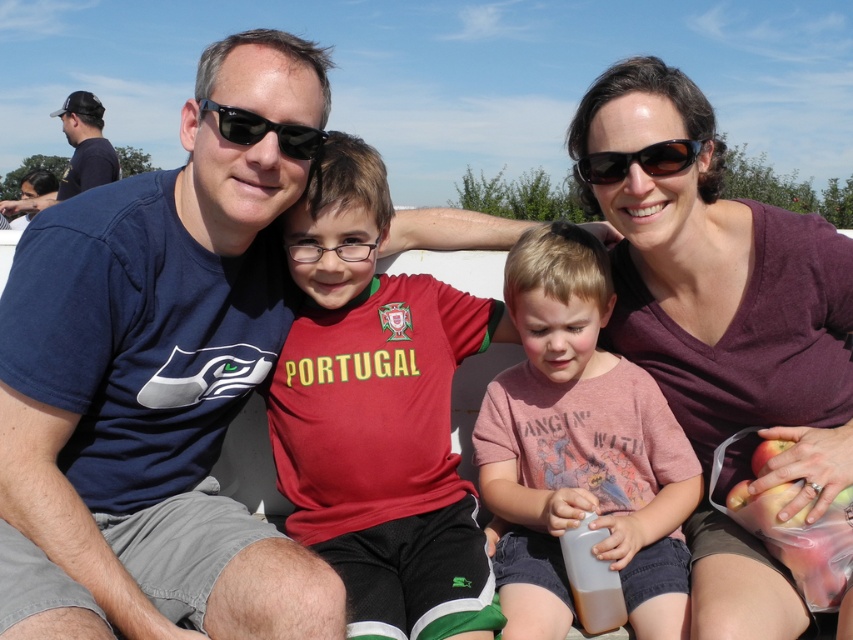
Question: Which of the following is the farthest from the observer?

Choices:
 (A) red jersey at center
 (B) black plastic sunglasses at center

Answer: (A)

Question: Does matte purple shirt at center have a greater width compared to matte black cap at upper left?

Choices:
 (A) no
 (B) yes

Answer: (B)

Question: Where is matte black cap at upper left located in relation to brown matte sunglasses at center in the image?

Choices:
 (A) left
 (B) right

Answer: (A)

Question: Estimate the real-world distances between objects in this image. Which object is farther from the pink cotton shirt at center?

Choices:
 (A) matte black cap at upper left
 (B) black plastic sunglasses at center

Answer: (A)

Question: Based on their relative distances, which object is farther from the matte black cap at upper left?

Choices:
 (A) brown matte sunglasses at center
 (B) matte purple shirt at center

Answer: (B)

Question: In this image, where is blue fabric shirt at left located relative to black plastic sunglasses at center?

Choices:
 (A) left
 (B) right

Answer: (A)